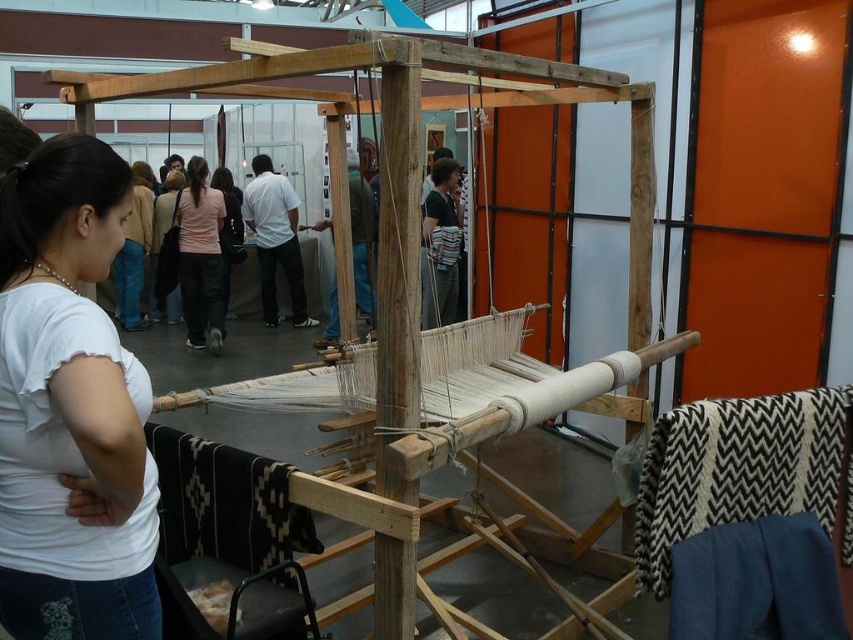
You are a tailor who needs to place a white cotton shirt at left on the loom. The loom has a working area that is 3 feet wide. Can the shirt fit on the loom?

The white cotton shirt at left is 3.45 feet wide, which is wider than the 3 feet working area of the loom. Therefore, the shirt cannot fit on the loom.

You are a tailor working with limited space in your workshop. You have a white cotton shirt at left and a pink fabric at center. Which item takes up more area in the workspace?

The pink fabric at center occupies more space than the white cotton shirt at left, so the pink fabric at center takes up more area in the workspace.

You are a tailor working with the white cotton shirt at left and the pink fabric at center. Which item is located to the right of the other?

The white cotton shirt at left is positioned on the right side of pink fabric at center, meaning the white cotton shirt at left is to the right of the pink fabric at center.